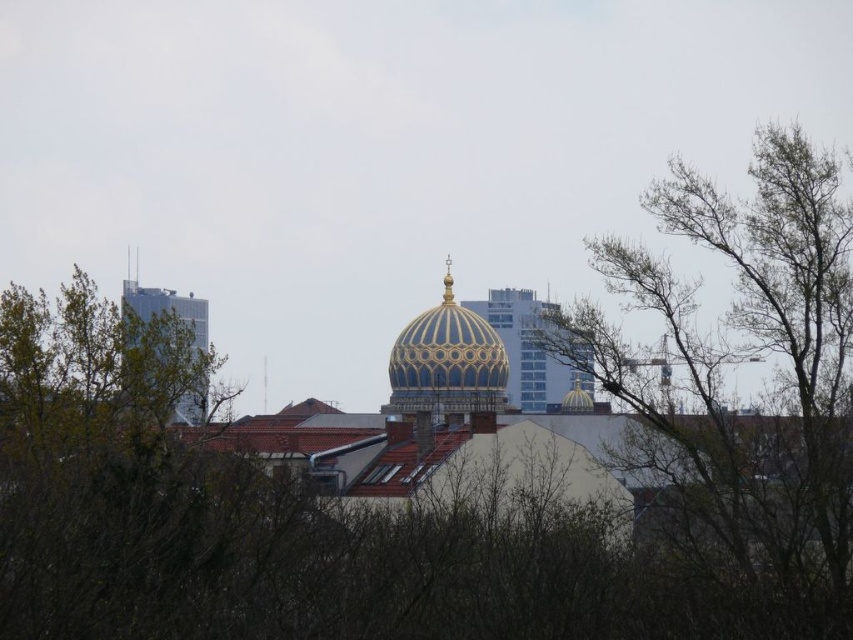
Question: Is bare branches at upper right to the right of glassy silver skyscraper at left from the viewer's perspective?

Choices:
 (A) yes
 (B) no

Answer: (A)

Question: Which point is farther to the camera?

Choices:
 (A) bare branches at upper right
 (B) glassy silver skyscraper at left
 (C) gold metallic dome at center

Answer: (C)

Question: Among these points, which one is farthest from the camera?

Choices:
 (A) (465, 339)
 (B) (827, 598)
 (C) (189, 397)

Answer: (C)

Question: Is bare branches at upper right bigger than gold metallic dome at center?

Choices:
 (A) yes
 (B) no

Answer: (A)

Question: Among these objects, which one is nearest to the camera?

Choices:
 (A) glassy silver skyscraper at left
 (B) gold metallic dome at center

Answer: (A)

Question: Does bare branches at upper right lie behind gold metallic dome at center?

Choices:
 (A) no
 (B) yes

Answer: (A)